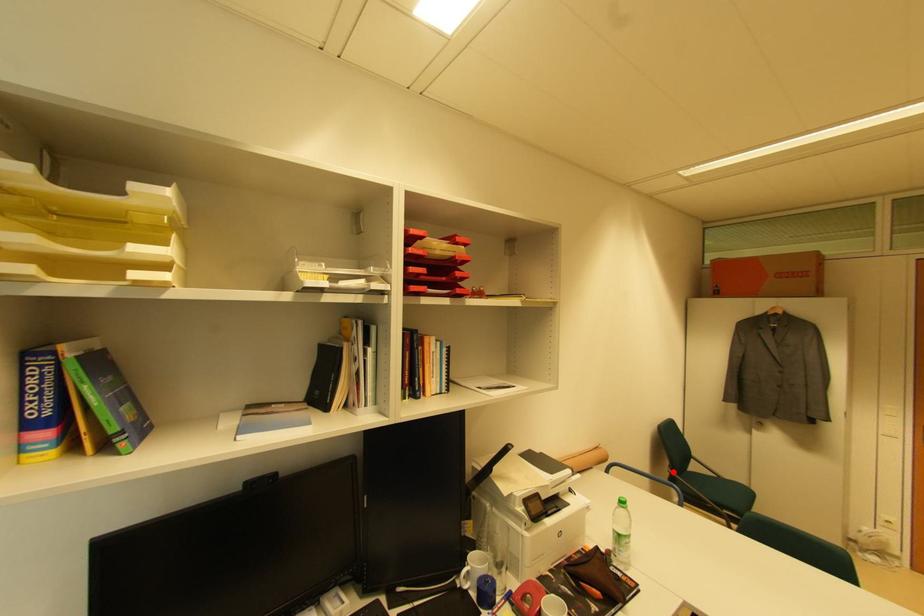
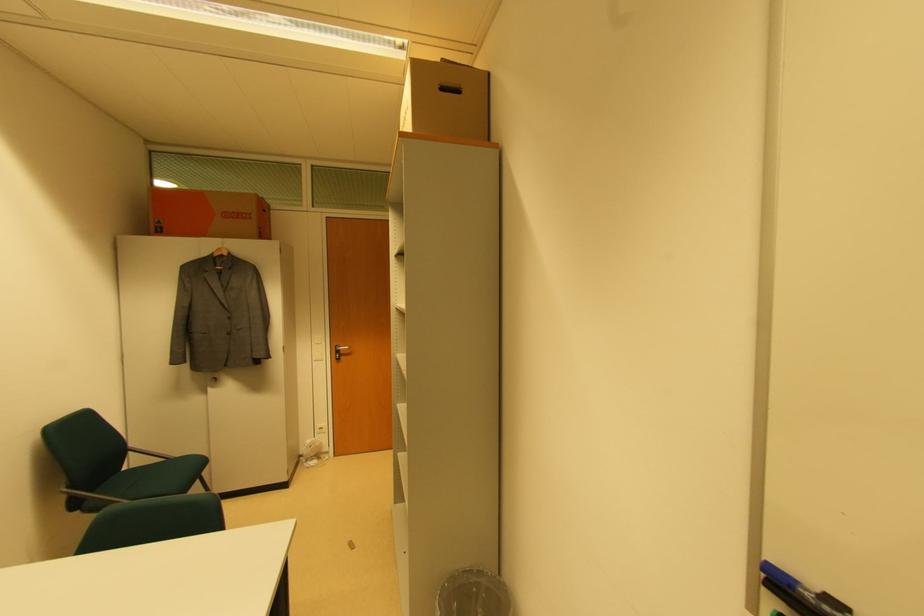
Question: I am providing you with two images of the same scene from different viewpoints. Given a red point in image1, look at the same physical point in image2. Is it:

Choices:
 (A) Closer to the viewpoint
 (B) Farther from the viewpoint

Answer: (B)